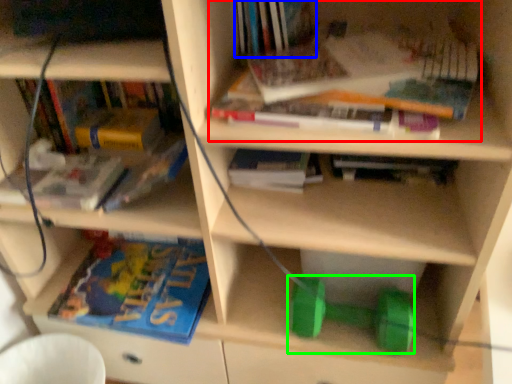
Question: Estimate the real-world distances between objects in this image. Which object is farther from book (highlighted by a red box), book (highlighted by a blue box) or dumbbell (highlighted by a green box)?

Choices:
 (A) book
 (B) dumbbell

Answer: (B)